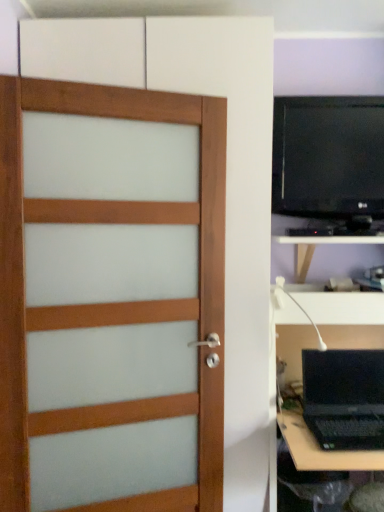
Question: Is satin wood door at left inside or outside of black plastic entertainment center at right?

Choices:
 (A) outside
 (B) inside

Answer: (A)

Question: Is satin wood door at left bigger or smaller than black plastic entertainment center at right?

Choices:
 (A) small
 (B) big

Answer: (A)

Question: Which is farther from the black matte laptop at lower right?

Choices:
 (A) black plastic entertainment center at right
 (B) black glossy monitor at upper right
 (C) white matte tv cabinet at lower right
 (D) white plastic lamp at right
 (E) satin wood door at left

Answer: (B)

Question: Which of these objects is positioned closest to the black glossy monitor at upper right?

Choices:
 (A) black matte laptop at lower right
 (B) black plastic entertainment center at right
 (C) white matte tv cabinet at lower right
 (D) satin wood door at left
 (E) white plastic lamp at right

Answer: (B)